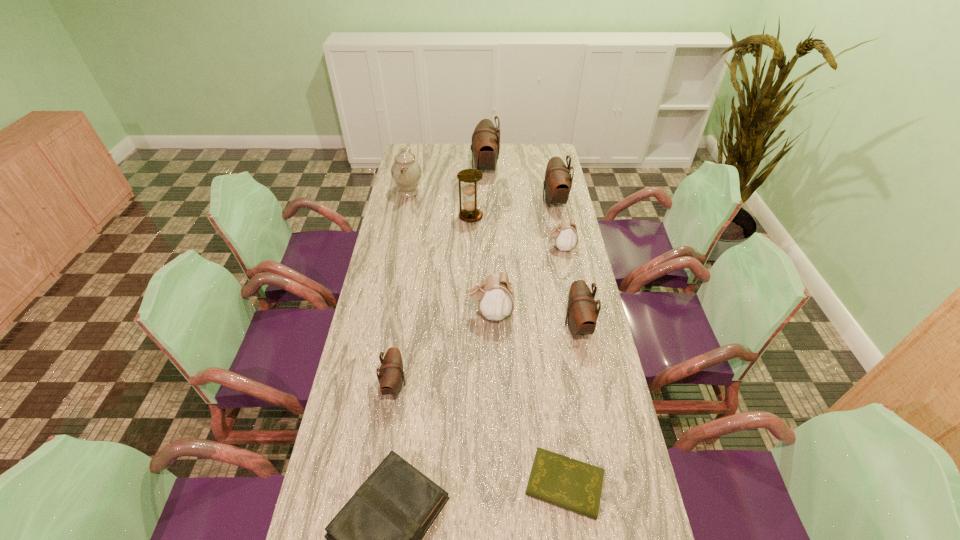
Where is `the fourth closest pouch to the shortest object`? Image resolution: width=960 pixels, height=540 pixels. the fourth closest pouch to the shortest object is located at coordinates tap(565, 234).

Find the location of a particular element. The width and height of the screenshot is (960, 540). the sixth closest pouch relative to the chinaware is located at coordinates (391, 375).

The image size is (960, 540). I want to click on brown pouch that is the closest to the brown hourglass, so click(485, 147).

Select which brown pouch is the second closest to the left white pouch. Please provide its 2D coordinates. Your answer should be formatted as a tuple, i.e. [(x, y)], where the tuple contains the x and y coordinates of a point satisfying the conditions above.

[(391, 375)]

I want to click on blank area in the image that satisfies the following two spatial constraints: 1. with the flap open on the second farthest pouch; 2. on the front side of the hourglass, so click(558, 216).

This screenshot has height=540, width=960. What are the coordinates of `vacant region that satisfies the following two spatial constraints: 1. with the flap open on the shortest object; 2. on the left side of the leftmost brown pouch` in the screenshot? It's located at (379, 484).